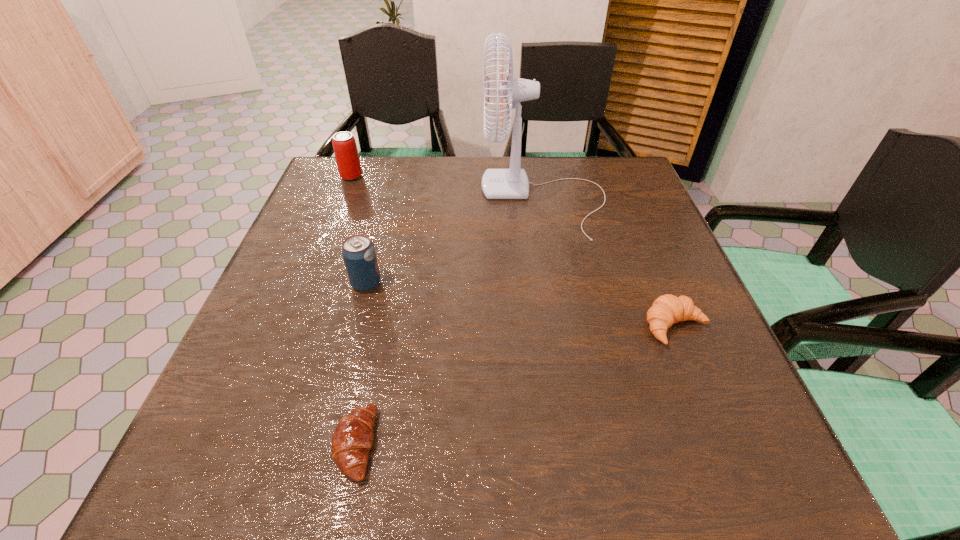
I want to click on object present at the far left corner, so click(347, 158).

Locate an element on the screen. object located in the far right corner section of the desktop is located at coordinates (512, 183).

The image size is (960, 540). In the image, there is a desktop. What are the coordinates of `vacant space at the far edge` in the screenshot? It's located at (442, 191).

You are a GUI agent. You are given a task and a screenshot of the screen. Output one action in this format:
    pyautogui.click(x=<x>, y=<y>)
    Task: Click on the free spot at the near edge of the desktop
    The height and width of the screenshot is (540, 960).
    Given the screenshot: What is the action you would take?
    pyautogui.click(x=456, y=445)

Locate an element on the screen. vacant space at the left edge is located at coordinates (335, 306).

Where is `vacant space at the right edge of the desktop`? The height and width of the screenshot is (540, 960). vacant space at the right edge of the desktop is located at coordinates (648, 256).

I want to click on vacant space at the near left corner, so click(x=282, y=478).

In the image, there is a desktop. At what (x,y) coordinates should I click in order to perform the action: click on vacant space at the far right corner. Please return your answer as a coordinate pair (x, y). Looking at the image, I should click on (599, 171).

Identify the location of vacant space that is in between the shortest object and the third farthest object. (361, 364).

Where is `empty location between the beer can and the pop soda`? The height and width of the screenshot is (540, 960). empty location between the beer can and the pop soda is located at coordinates (359, 230).